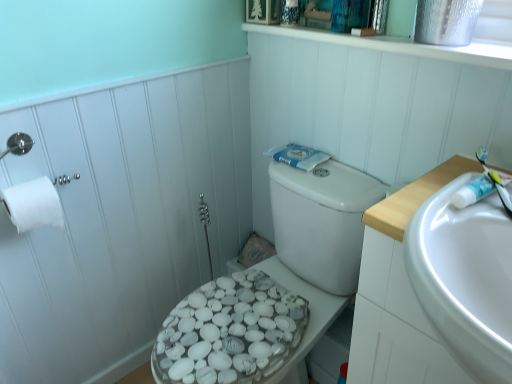
Where is `free spot to the left of white plastic toothbrush at right`? free spot to the left of white plastic toothbrush at right is located at coordinates (418, 205).